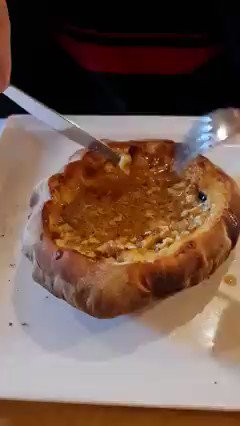
At what (x,y) coordinates should I click in order to perform the action: click on crumb. Please return your answer as a coordinate pair (x, y). Looking at the image, I should click on (10, 323).